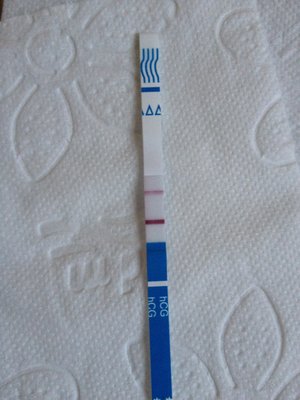
This screenshot has width=300, height=400. Identify the location of paper towl. [x=219, y=201].